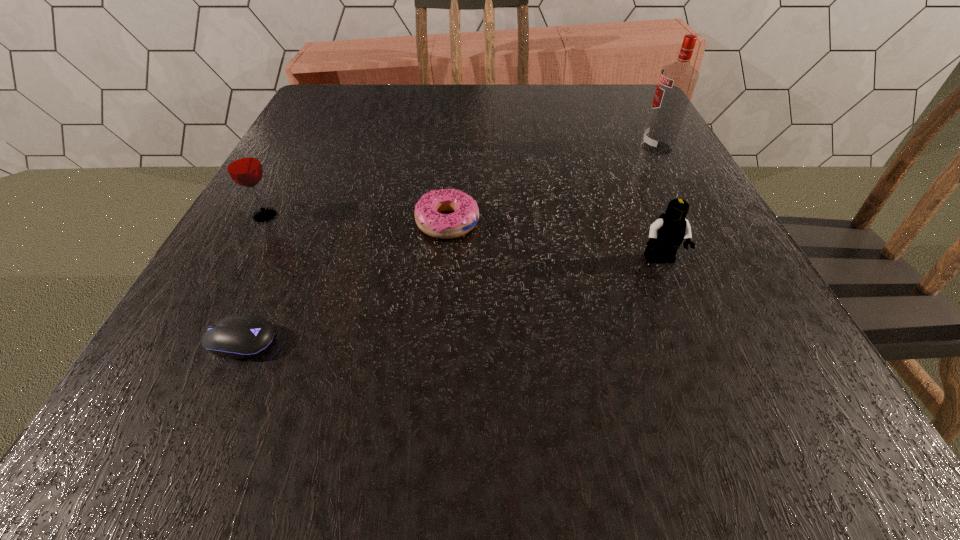
Where is `vacant area between the vodka and the Lego`? The width and height of the screenshot is (960, 540). vacant area between the vodka and the Lego is located at coordinates (659, 204).

The width and height of the screenshot is (960, 540). In order to click on vacant space in between the doughnut and the shortest object in this screenshot , I will do `click(344, 282)`.

Identify the location of empty space between the doughnut and the second tallest object. (356, 219).

Where is `vacant area that lies between the second tallest object and the shortest object`? vacant area that lies between the second tallest object and the shortest object is located at coordinates (252, 278).

At what (x,y) coordinates should I click in order to perform the action: click on unoccupied area between the computer mouse and the glass. Please return your answer as a coordinate pair (x, y). This screenshot has width=960, height=540. Looking at the image, I should click on (252, 278).

Locate an element on the screen. This screenshot has width=960, height=540. unoccupied area between the doughnut and the computer mouse is located at coordinates (344, 282).

The image size is (960, 540). I want to click on vacant area that lies between the fourth shortest object and the nearest object, so click(x=252, y=278).

Identify the location of empty space that is in between the fourth shortest object and the doughnut. (356, 219).

Select which object is the closest to the fourth farthest object. Please provide its 2D coordinates. Your answer should be formatted as a tuple, i.e. [(x, y)], where the tuple contains the x and y coordinates of a point satisfying the conditions above.

[(428, 217)]

Where is `object that stands as the fourth closest to the third tallest object`? Image resolution: width=960 pixels, height=540 pixels. object that stands as the fourth closest to the third tallest object is located at coordinates (242, 163).